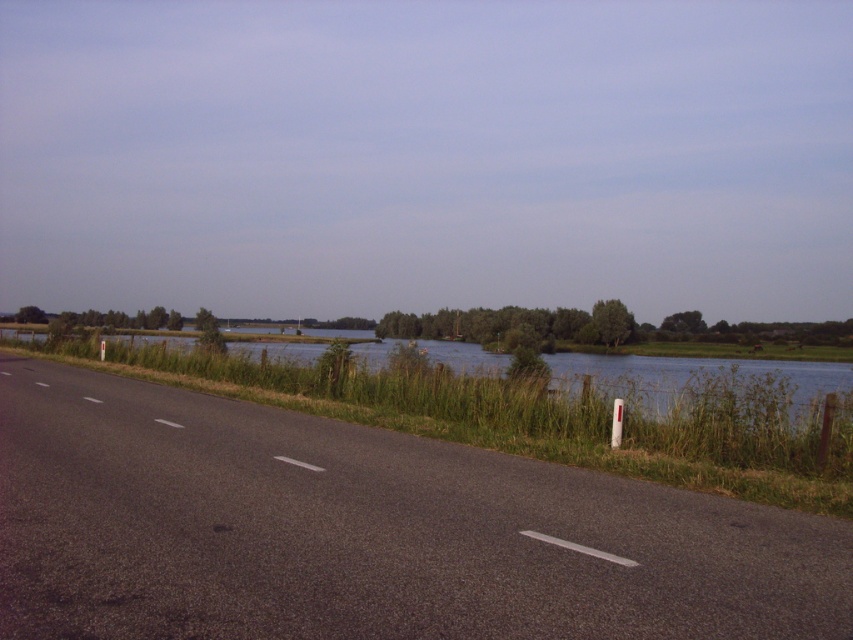
You are a drone operator trying to capture aerial footage of the black asphalt highway at center. You need to ensure your drone stays within the boundaries of the road. Given that the road is represented by the point at coordinates point (x=364, y=531), can you confirm if the drone is currently positioned over the road?

The black asphalt highway at center is represented by point (x=364, y=531), so if the drone is positioned at that point, it is indeed over the road.

You are standing at the camera position observing the scene. There are two points marked in the image, point 1 at coordinates point [131,582] and point 2 at coordinates point [625,371]. Which point is physically closer to your current position?

Point 1 at coordinates point [131,582] is closer to the camera than point 2 at coordinates point [625,371], so the point closer to your current position is point 1 at coordinates point [131,582].